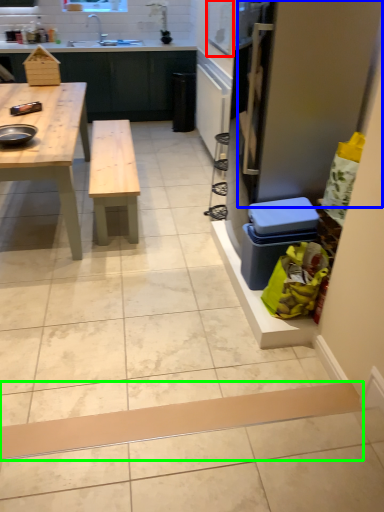
Question: Based on their relative distances, which object is nearer to window screen (highlighted by a red box)? Choose from screen door (highlighted by a blue box) and plank (highlighted by a green box).

Choices:
 (A) screen door
 (B) plank

Answer: (A)